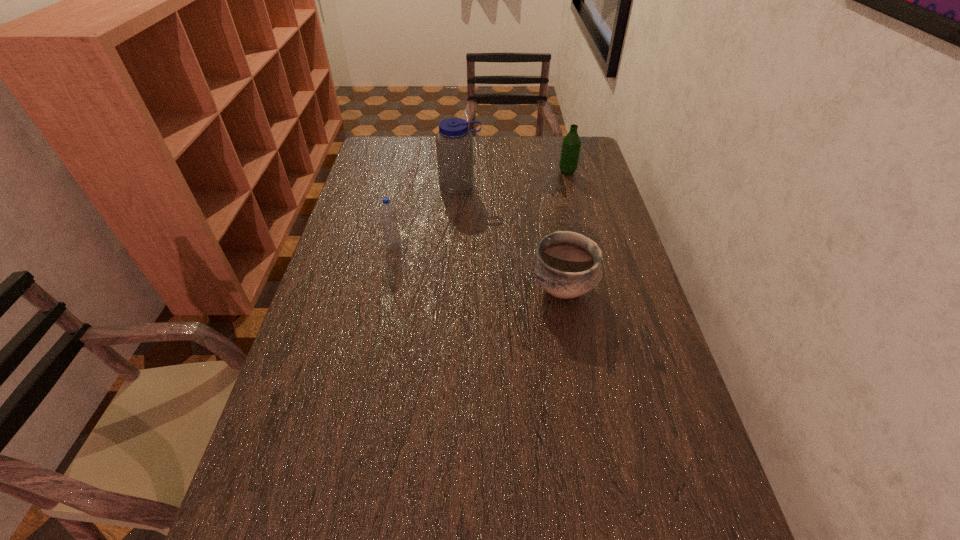
Find the location of a particular element. This screenshot has width=960, height=540. free area in between the shortest object and the third object from right to left is located at coordinates (512, 238).

Where is `free space that is in between the nearest water bottle and the rightmost water bottle`? free space that is in between the nearest water bottle and the rightmost water bottle is located at coordinates (481, 209).

The image size is (960, 540). Identify the location of free point between the tallest object and the nearest water bottle. (427, 215).

Find the location of a particular element. The width and height of the screenshot is (960, 540). vacant area that lies between the second nearest object and the nearest object is located at coordinates [478, 267].

Locate an element on the screen. Image resolution: width=960 pixels, height=540 pixels. empty space that is in between the tallest object and the rightmost water bottle is located at coordinates (514, 179).

The image size is (960, 540). What are the coordinates of `free space between the rightmost water bottle and the nearest object` in the screenshot? It's located at (564, 231).

The width and height of the screenshot is (960, 540). I want to click on vacant space in between the nearest water bottle and the rightmost water bottle, so click(x=481, y=209).

The height and width of the screenshot is (540, 960). In order to click on vacant area that lies between the rightmost water bottle and the second nearest object in this screenshot , I will do `click(481, 209)`.

Identify the location of vacant area that lies between the nearest object and the tallest object. The height and width of the screenshot is (540, 960). (512, 238).

Find the location of a particular element. Image resolution: width=960 pixels, height=540 pixels. free space between the rightmost water bottle and the pottery is located at coordinates (564, 231).